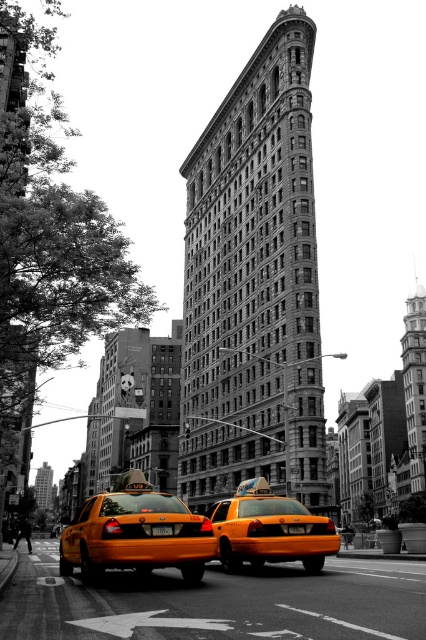
You are standing at the point with coordinates (135, 532) in the image. What object are you located on?

The point with coordinates (135, 532) is located on the yellow matte taxi at lower center.

You are standing at the point with coordinates point (74, 524) and want to walk to the point with coordinates point (307, 531). Which direction should you move to reach your destination?

You should move forward because point (74, 524) is behind point (307, 531), so moving forward from point (74, 524) will lead you toward point (307, 531).